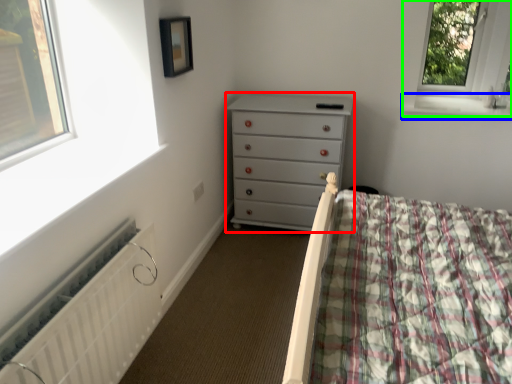
Question: Considering the real-world distances, which object is farthest from chest of drawers (highlighted by a red box)? window sill (highlighted by a blue box) or window (highlighted by a green box)?

Choices:
 (A) window sill
 (B) window

Answer: (B)